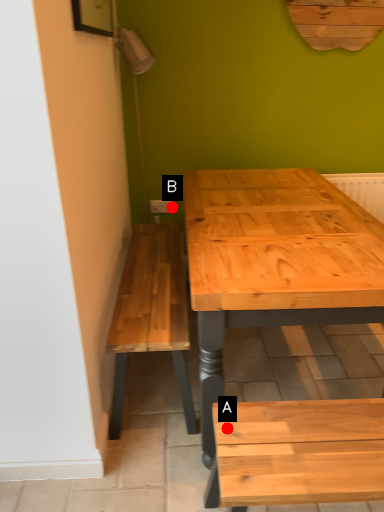
Question: Two points are circled on the image, labeled by A and B beside each circle. Among these points, which one is farthest from the camera?

Choices:
 (A) A is further
 (B) B is further

Answer: (B)